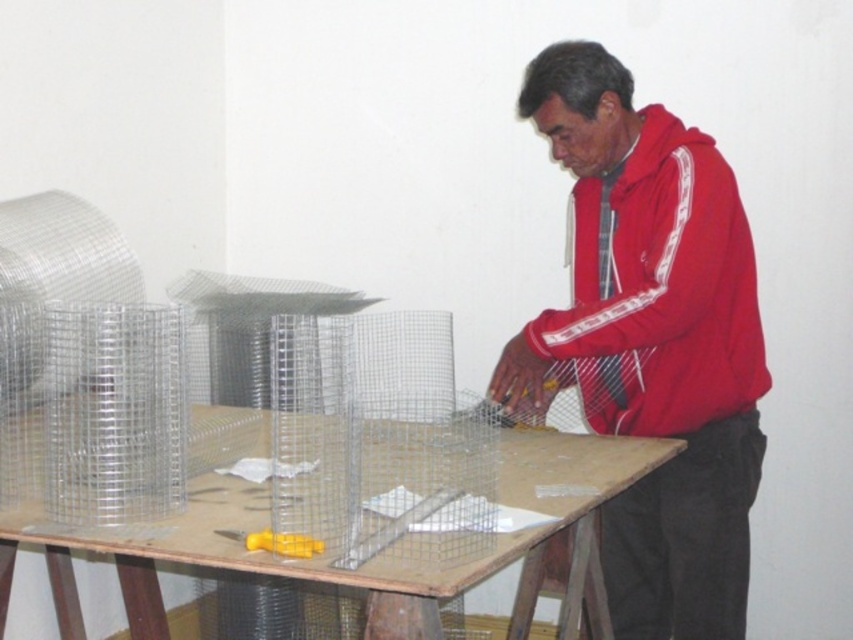
Question: Is wooden table at center closer to the viewer compared to yellow plastic screwdriver at center?

Choices:
 (A) yes
 (B) no

Answer: (A)

Question: Estimate the real-world distances between objects in this image. Which object is farther from the red fleece jacket at center?

Choices:
 (A) yellow plastic screwdriver at center
 (B) wooden table at center
 (C) red matte jacket at center

Answer: (A)

Question: Which point is closer to the camera?

Choices:
 (A) (663, 337)
 (B) (397, 576)
 (C) (570, 301)
 (D) (303, 540)

Answer: (B)

Question: Does red matte jacket at center have a greater width compared to yellow plastic screwdriver at center?

Choices:
 (A) yes
 (B) no

Answer: (A)

Question: Which object is farther from the camera taking this photo?

Choices:
 (A) red matte jacket at center
 (B) red fleece jacket at center

Answer: (A)

Question: Considering the relative positions of red matte jacket at center and wooden table at center in the image provided, where is red matte jacket at center located with respect to wooden table at center?

Choices:
 (A) right
 (B) left

Answer: (A)